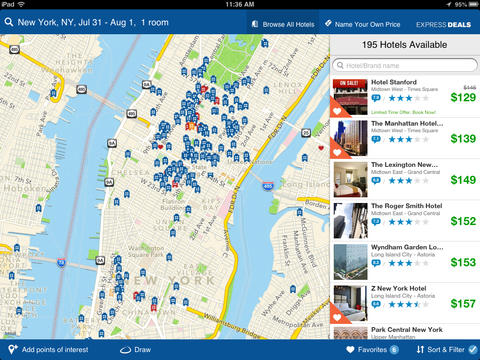
Locate an element on the screen. hotels is located at coordinates (388, 43).